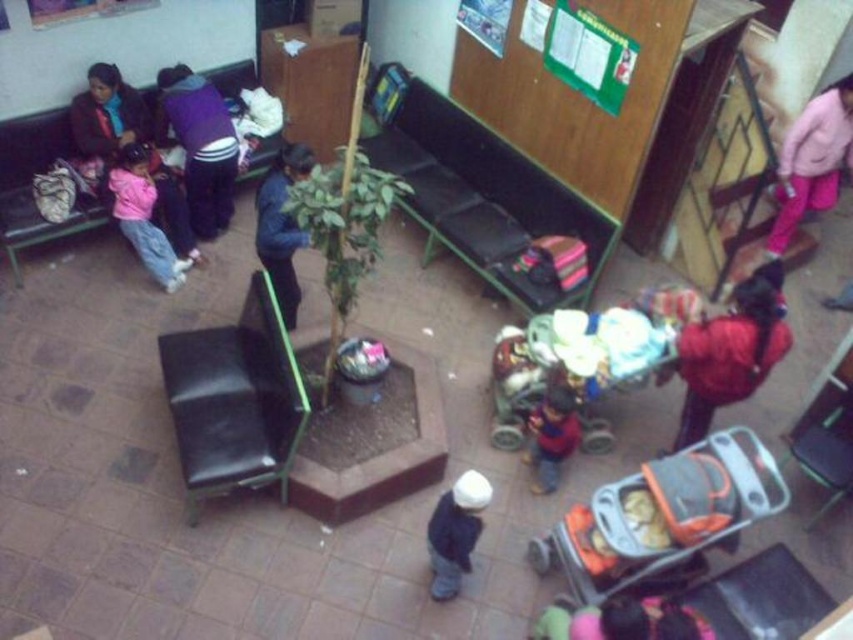
Does point (138, 257) come closer to viewer compared to point (471, 516)?

That is False.

Between point (117, 182) and point (465, 566), which one is positioned behind?

The point (117, 182) is more distant.

I want to click on pink fleece jacket at upper left, so click(143, 216).

The height and width of the screenshot is (640, 853). I want to click on pink fleece jacket at upper left, so click(143, 216).

Measure the distance between green fabric bench at center and red fabric bag at lower right.

6.88 feet

Does green fabric bench at center have a lesser width compared to red fabric bag at lower right?

No, green fabric bench at center is not thinner than red fabric bag at lower right.

Find the location of `green fabric bench at center`. green fabric bench at center is located at coordinates (483, 196).

Is purple fleece jacket at upper left below matte purple sweater at upper left?

No, purple fleece jacket at upper left is not below matte purple sweater at upper left.

Can you confirm if purple fleece jacket at upper left is positioned to the left of matte purple sweater at upper left?

Incorrect, purple fleece jacket at upper left is not on the left side of matte purple sweater at upper left.

Is point (196, 173) positioned behind point (172, 182)?

No, it is not.

At what (x,y) coordinates should I click in order to perform the action: click on purple fleece jacket at upper left. Please return your answer as a coordinate pair (x, y). Image resolution: width=853 pixels, height=640 pixels. Looking at the image, I should click on (200, 145).